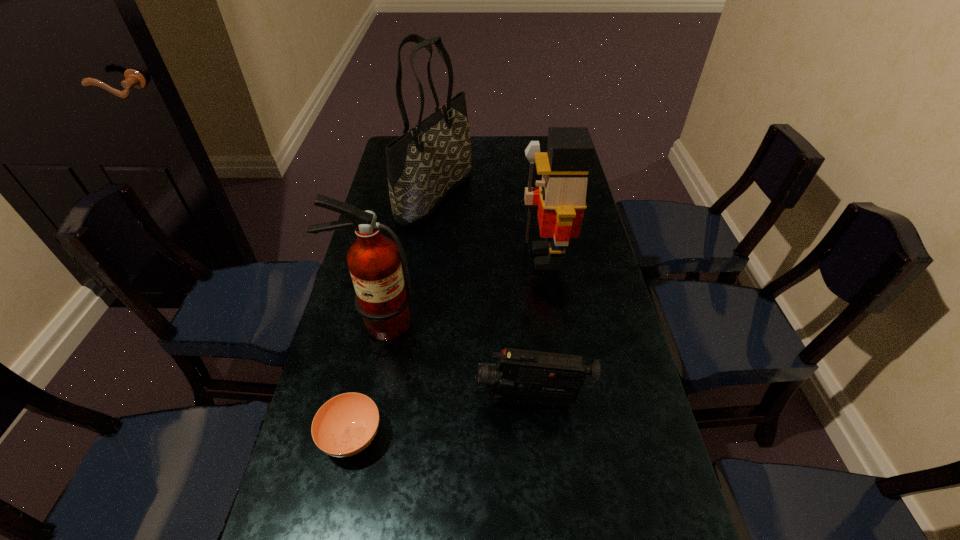
Where is `vacant space that's between the camcorder and the nutcracker`? Image resolution: width=960 pixels, height=540 pixels. vacant space that's between the camcorder and the nutcracker is located at coordinates (539, 329).

Find the location of a particular element. vacant area that lies between the fire extinguisher and the nutcracker is located at coordinates point(462,290).

At what (x,y) coordinates should I click in order to perform the action: click on object that stands as the closest to the soup bowl. Please return your answer as a coordinate pair (x, y). This screenshot has width=960, height=540. Looking at the image, I should click on (x=382, y=299).

Find the location of a particular element. The width and height of the screenshot is (960, 540). the fourth closest object relative to the tallest object is located at coordinates [x=345, y=425].

At what (x,y) coordinates should I click in order to perform the action: click on vacant position in the image that satisfies the following two spatial constraints: 1. on the back side of the tallest object; 2. on the right side of the soup bowl. Please return your answer as a coordinate pair (x, y). Looking at the image, I should click on (403, 195).

At what (x,y) coordinates should I click in order to perform the action: click on vacant point that satisfies the following two spatial constraints: 1. in front of the second farthest object holding the staff; 2. on the front side of the shortest object. Please return your answer as a coordinate pair (x, y). This screenshot has width=960, height=540. Looking at the image, I should click on (574, 437).

Locate an element on the screen. The image size is (960, 540). free spot that satisfies the following two spatial constraints: 1. on the back side of the tallest object; 2. on the right side of the shortest object is located at coordinates (403, 195).

Find the location of `free location that satisfies the following two spatial constraints: 1. in front of the nutcracker holding the staff; 2. on the nozzle and handle of the fire extinguisher`. free location that satisfies the following two spatial constraints: 1. in front of the nutcracker holding the staff; 2. on the nozzle and handle of the fire extinguisher is located at coordinates (556, 322).

The image size is (960, 540). Find the location of `vacant position in the image that satisfies the following two spatial constraints: 1. in front of the fourth nearest object holding the staff; 2. on the front side of the shortest object`. vacant position in the image that satisfies the following two spatial constraints: 1. in front of the fourth nearest object holding the staff; 2. on the front side of the shortest object is located at coordinates (574, 437).

The width and height of the screenshot is (960, 540). I want to click on blank area in the image that satisfies the following two spatial constraints: 1. in front of the fourth nearest object holding the staff; 2. on the nozzle and handle of the fire extinguisher, so point(556,322).